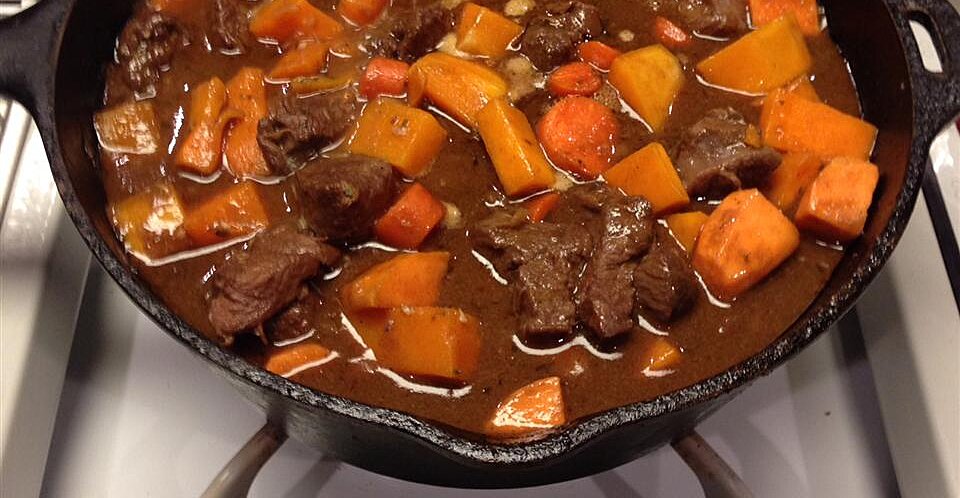
Image resolution: width=960 pixels, height=498 pixels. Find the location of `edge of pot`. edge of pot is located at coordinates (419, 438).